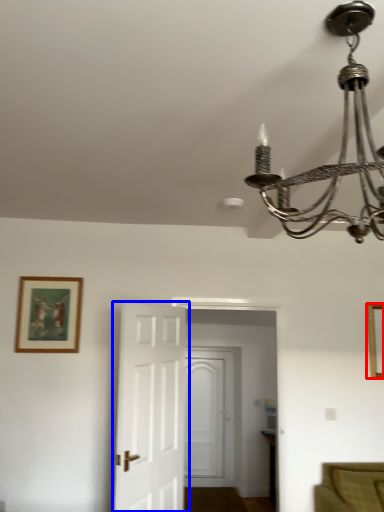
Question: Which object is further to the camera taking this photo, picture frame (highlighted by a red box) or door (highlighted by a blue box)?

Choices:
 (A) picture frame
 (B) door

Answer: (A)